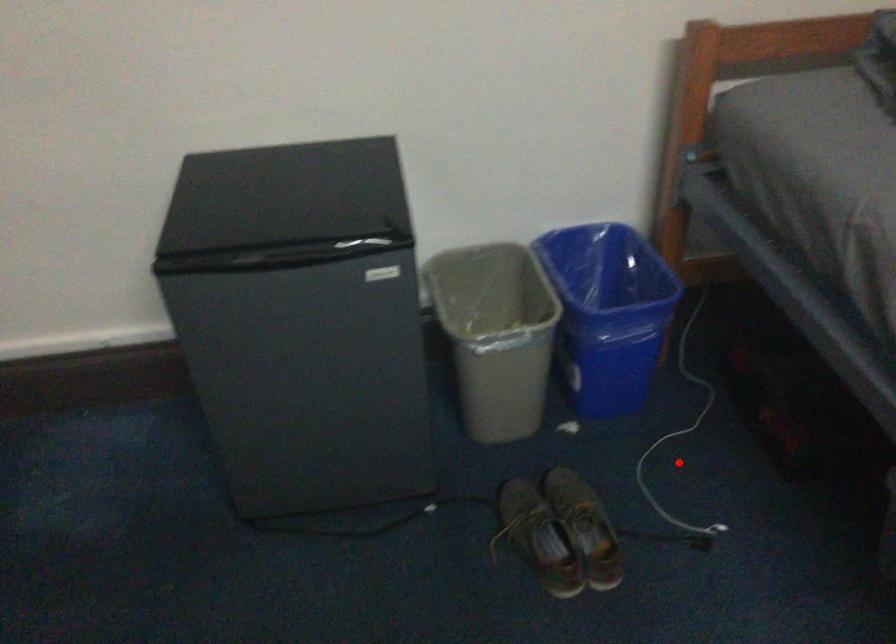
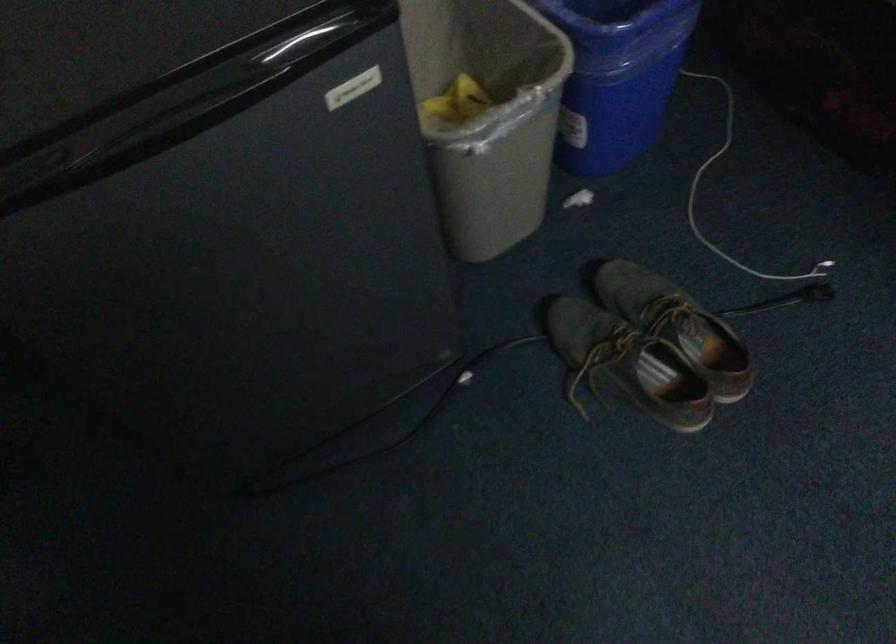
Find the pixel in the second image that matches the highlighted location in the first image.

(734, 196)